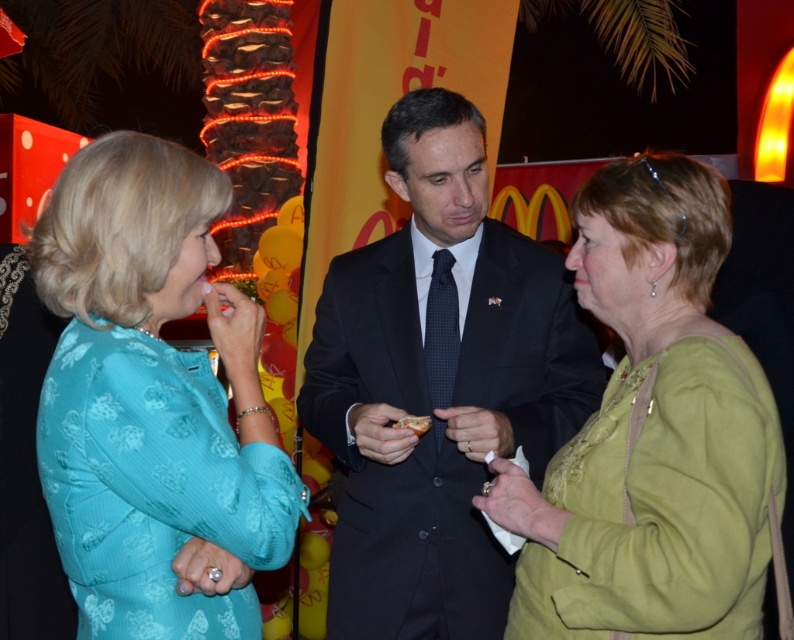
Question: Can you confirm if teal fabric dress at left is positioned to the left of golden crispy bread at center?

Choices:
 (A) yes
 (B) no

Answer: (A)

Question: Which of the following is the closest to the observer?

Choices:
 (A) (561, 364)
 (B) (411, 422)

Answer: (B)

Question: Can you confirm if dark suit at center is thinner than green fabric jacket at center?

Choices:
 (A) yes
 (B) no

Answer: (B)

Question: Which object is closer to the camera taking this photo?

Choices:
 (A) dark suit at center
 (B) golden crispy bread at center

Answer: (B)

Question: Considering the real-world distances, which object is farthest from the teal fabric dress at left?

Choices:
 (A) dark suit at center
 (B) green fabric jacket at center

Answer: (B)

Question: Observing the image, what is the correct spatial positioning of dark suit at center in reference to teal fabric dress at left?

Choices:
 (A) right
 (B) left

Answer: (A)